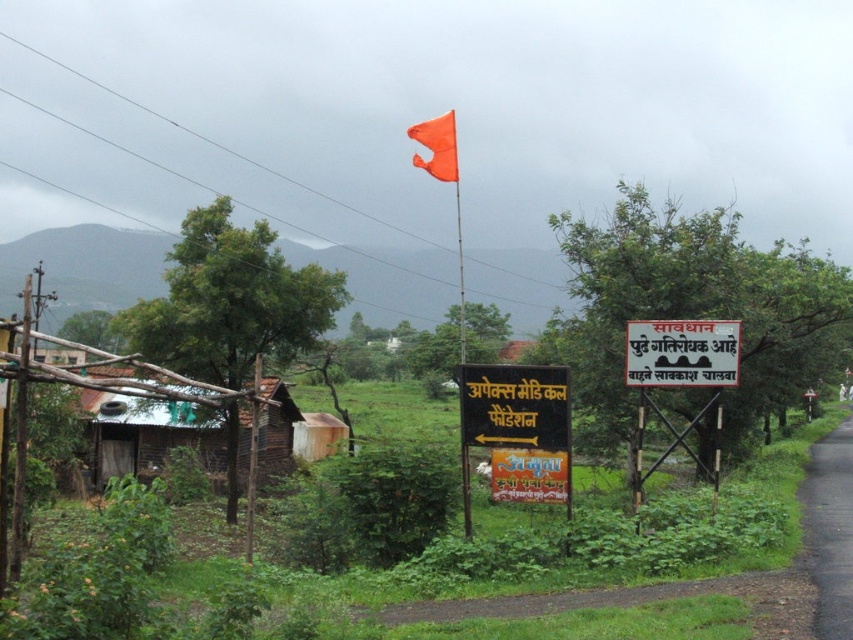
Can you confirm if white plastic signboard at center is positioned to the left of orange fabric flag at upper center?

In fact, white plastic signboard at center is to the right of orange fabric flag at upper center.

Does white plastic signboard at center have a smaller size compared to orange fabric flag at upper center?

Correct, white plastic signboard at center occupies less space than orange fabric flag at upper center.

Image resolution: width=853 pixels, height=640 pixels. Identify the location of white plastic signboard at center. (682, 376).

Identify the location of white plastic signboard at center. (682, 376).

Locate an element on the screen. white plastic signboard at center is located at coordinates (682, 376).

This screenshot has height=640, width=853. Identify the location of white plastic signboard at center. (682, 376).

Which is above, white plastic sign at center or orange fabric flag at center?

Positioned higher is orange fabric flag at center.

Can you confirm if white plastic sign at center is thinner than orange fabric flag at center?

Indeed, white plastic sign at center has a lesser width compared to orange fabric flag at center.

The height and width of the screenshot is (640, 853). I want to click on white plastic sign at center, so click(682, 353).

I want to click on white plastic sign at center, so click(x=682, y=353).